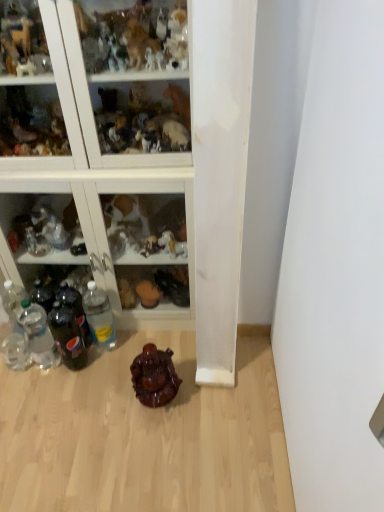
Locate an element on the screen. Image resolution: width=384 pixels, height=512 pixels. vacant region to the right of shiny brown statue at center is located at coordinates (212, 398).